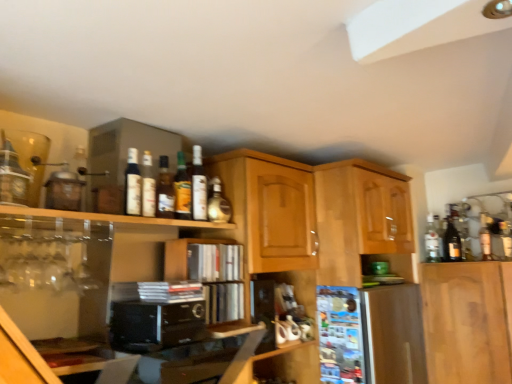
Question: Relative to matte glass bottle at upper center, the sixth bottle in the left-to-right sequence, is wooden cabinet at upper center, the second cabinetry in the right-to-left sequence, in front or behind?

Choices:
 (A) front
 (B) behind

Answer: (A)

Question: In the image, is wooden cabinet at upper center, marked as the 2th cabinetry in a left-to-right arrangement, on the left side or the right side of matte glass bottle at upper center, the second bottle in the right-to-left sequence?

Choices:
 (A) right
 (B) left

Answer: (A)

Question: Estimate the real-world distances between objects in this image. Which object is farther from the wooden cabinet at upper center, marked as the 2th cabinetry in a left-to-right arrangement?

Choices:
 (A) black matte microwave at center
 (B) matte glass bottle at upper left, the 7th bottle from the right
 (C) clear glass bottle at right, arranged as the seventh bottle when viewed from the left
 (D) matte glass bottle at upper center, placed as the 4th bottle when sorted from left to right
 (E) wooden cabinet at center, arranged as the third cabinetry when viewed from the right

Answer: (B)

Question: Which object is the closest to the clear glass bottle at right, which is the first bottle in right-to-left order?

Choices:
 (A) matte glass bottle at upper center, the fifth bottle in the left-to-right sequence
 (B) wooden cabinet at center, the first cabinetry positioned from the left
 (C) matte glass bottle at upper center, which ranks as the 4th bottle in right-to-left order
 (D) glossy wood cabinet at upper right, positioned as the 3th cabinetry in left-to-right order
 (E) translucent glass bottle at center, the third bottle when ordered from left to right

Answer: (D)